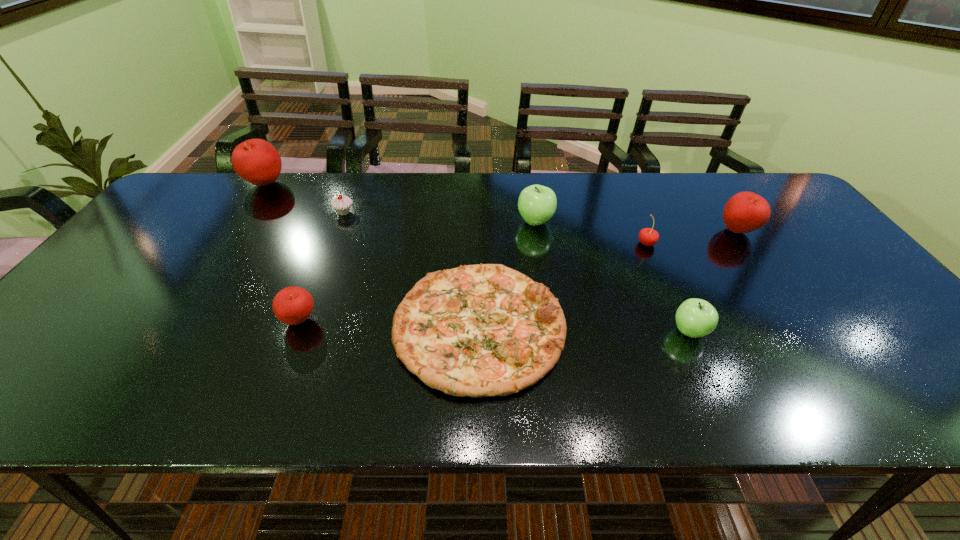
Select which red apple is the closest to the leftmost apple. Please provide its 2D coordinates. Your answer should be formatted as a tuple, i.e. [(x, y)], where the tuple contains the x and y coordinates of a point satisfying the conditions above.

[(293, 305)]

The image size is (960, 540). Find the location of `vacant space that satisfies the following two spatial constraints: 1. on the back side of the shortest object; 2. on the right side of the cherry`. vacant space that satisfies the following two spatial constraints: 1. on the back side of the shortest object; 2. on the right side of the cherry is located at coordinates (479, 244).

Where is `free space that satisfies the following two spatial constraints: 1. on the front side of the right green apple; 2. on the right side of the brown pizza`? The image size is (960, 540). free space that satisfies the following two spatial constraints: 1. on the front side of the right green apple; 2. on the right side of the brown pizza is located at coordinates (479, 332).

At what (x,y) coordinates should I click in order to perform the action: click on vacant area that satisfies the following two spatial constraints: 1. on the front side of the bigger green apple; 2. on the right side of the smaller green apple. Please return your answer as a coordinate pair (x, y). This screenshot has height=540, width=960. Looking at the image, I should click on (553, 332).

This screenshot has width=960, height=540. What are the coordinates of `free space that satisfies the following two spatial constraints: 1. on the front side of the shortest object; 2. on the right side of the cupcake` in the screenshot? It's located at (299, 328).